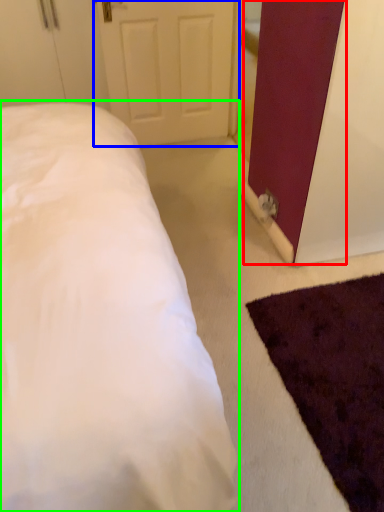
Question: Based on their relative distances, which object is farther from barn door (highlighted by a red box)? Choose from door (highlighted by a blue box) and bed (highlighted by a green box).

Choices:
 (A) door
 (B) bed

Answer: (A)